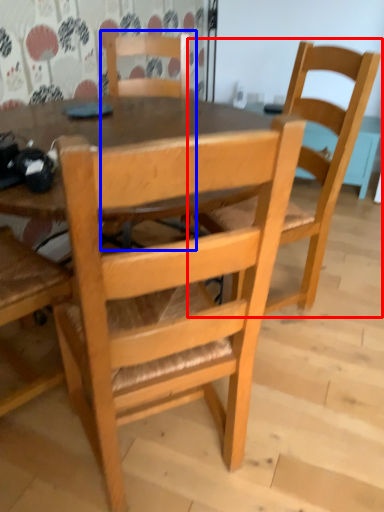
Question: Which of the following is the closest to the observer, chair (highlighted by a red box) or chair (highlighted by a blue box)?

Choices:
 (A) chair
 (B) chair

Answer: (A)